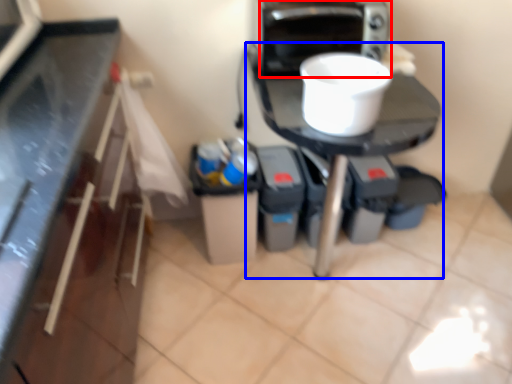
Question: Among these objects, which one is nearest to the camera, home appliance (highlighted by a red box) or table (highlighted by a blue box)?

Choices:
 (A) home appliance
 (B) table

Answer: (B)